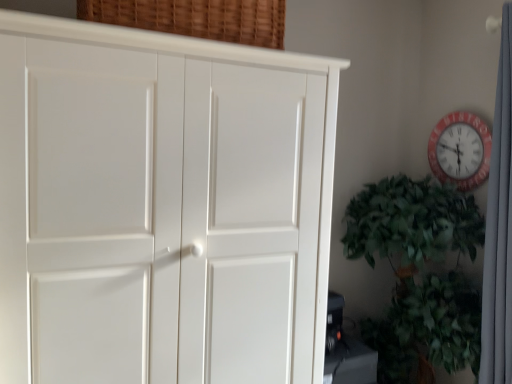
Question: Based on their positions, is red plastic wall clock at upper right located to the left or right of white fabric curtain at right?

Choices:
 (A) left
 (B) right

Answer: (A)

Question: Is red plastic wall clock at upper right taller or shorter than white fabric curtain at right?

Choices:
 (A) tall
 (B) short

Answer: (B)

Question: Based on their relative distances, which object is nearer to the white fabric curtain at right?

Choices:
 (A) woven wood basket at upper center
 (B) green leafy plant at right
 (C) white matte cupboard at left
 (D) red plastic wall clock at upper right

Answer: (B)

Question: Which is nearer to the green leafy plant at right?

Choices:
 (A) white fabric curtain at right
 (B) red plastic wall clock at upper right
 (C) woven wood basket at upper center
 (D) white matte cupboard at left

Answer: (A)